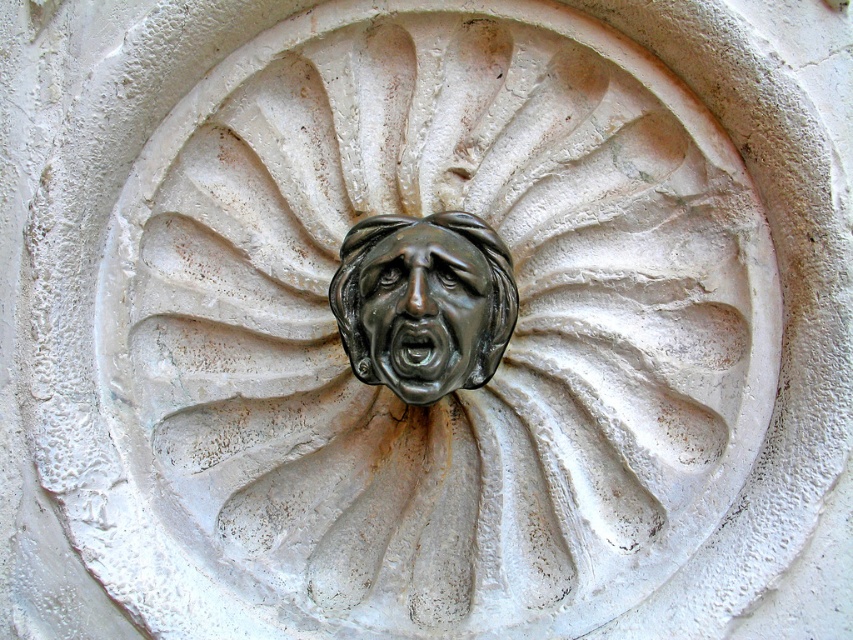
Question: Does bronze/sculpted face at center have a smaller size compared to shiny bronze face at center?

Choices:
 (A) no
 (B) yes

Answer: (A)

Question: Is bronze/sculpted face at center further to the viewer compared to shiny bronze face at center?

Choices:
 (A) no
 (B) yes

Answer: (A)

Question: Considering the relative positions of bronze/sculpted face at center and shiny bronze face at center in the image provided, where is bronze/sculpted face at center located with respect to shiny bronze face at center?

Choices:
 (A) below
 (B) above

Answer: (B)

Question: Which point appears closest to the camera in this image?

Choices:
 (A) (508, 317)
 (B) (466, 323)

Answer: (B)

Question: Which point is closer to the camera taking this photo?

Choices:
 (A) pos(439,344)
 (B) pos(479,342)

Answer: (A)